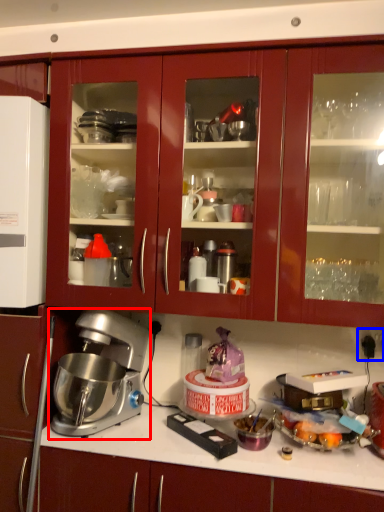
Question: Which object appears farthest to the camera in this image, mixer (highlighted by a red box) or electric outlet (highlighted by a blue box)?

Choices:
 (A) mixer
 (B) electric outlet

Answer: (B)